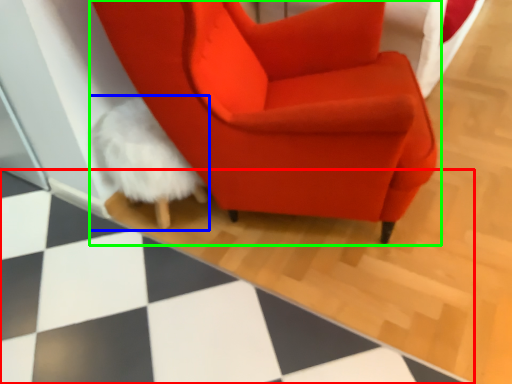
Question: Based on their relative distances, which object is nearer to tile (highlighted by a red box)? Choose from bean bag chair (highlighted by a blue box) and chair (highlighted by a green box).

Choices:
 (A) bean bag chair
 (B) chair

Answer: (A)